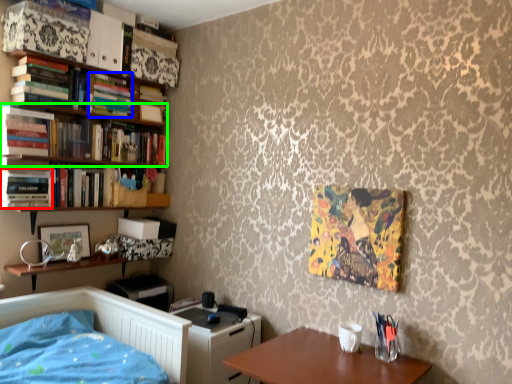
Question: Which object is the farthest from book (highlighted by a red box)? Choose among these: book (highlighted by a blue box) or book (highlighted by a green box).

Choices:
 (A) book
 (B) book

Answer: (A)